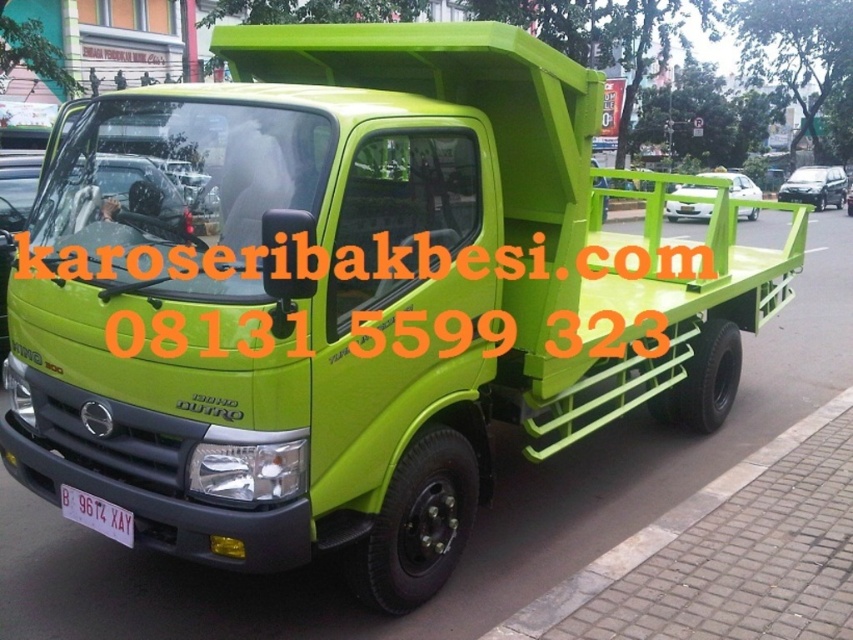
You are a delivery driver who needs to pass through the area where the matte green truck at center and the green matte truck at center are located. Can you drive your vehicle through the gap between them?

The matte green truck at center is in front of the green matte truck at center, so there is no gap between them. You cannot drive through the gap between them.